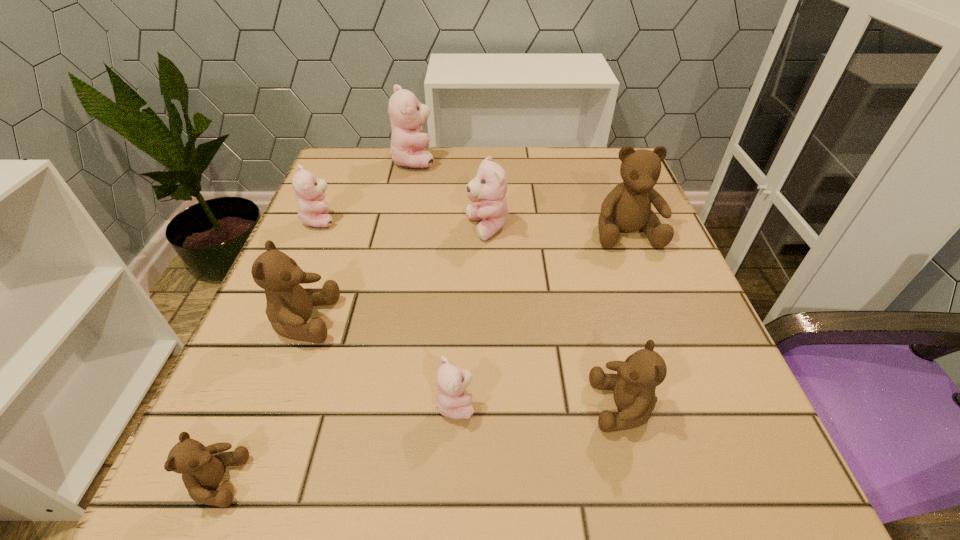
Identify the location of the fifth object from right to left. (407, 115).

I want to click on the fifth teddy bear from right to left, so click(x=407, y=115).

The width and height of the screenshot is (960, 540). I want to click on the farthest brown teddy bear, so click(x=627, y=208).

Where is `the second biggest pink teddy bear`? the second biggest pink teddy bear is located at coordinates (489, 187).

Where is `the fourth nearest object`? The width and height of the screenshot is (960, 540). the fourth nearest object is located at coordinates (289, 306).

This screenshot has width=960, height=540. In order to click on the fifth farthest teddy bear in this screenshot , I will do `click(289, 306)`.

In order to click on the leftmost pink teddy bear in this screenshot , I will do click(309, 190).

In order to click on the third farthest brown teddy bear in this screenshot , I will do `click(634, 385)`.

This screenshot has width=960, height=540. I want to click on the smallest pink teddy bear, so click(451, 402).

What are the coordinates of `the nearest object` in the screenshot? It's located at tap(202, 468).